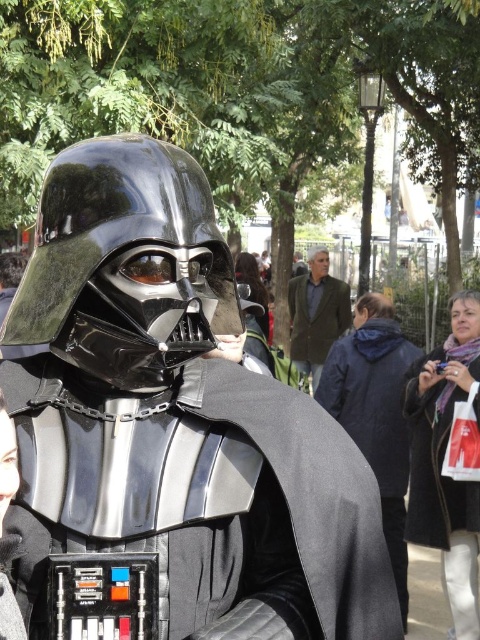
You are an event organizer planning a costume contest and need to ensure all costumes fit within a 2x2 meter display area. Given the black matte cape at center and the green textured jacket at center, which costume piece is more likely to fit within the display area without requiring additional space?

The black matte cape at center occupies less space than the green textured jacket at center, so it is more likely to fit within the 2x2 meter display area without needing extra space.

In the park scene with Darth Vader costume, there is a black matte cape at center and a green textured jacket at center. From the perspective of someone facing the costume, which object is located to the left?

The green textured jacket at center is located to the left of the black matte cape at center.

You are a costume designer assessing the image. You need to determine which object at the center is narrower between the black matte cape at center and the green textured jacket at center. Which one is it?

The black matte cape at center is thinner than the green textured jacket at center, so the black matte cape at center is narrower.